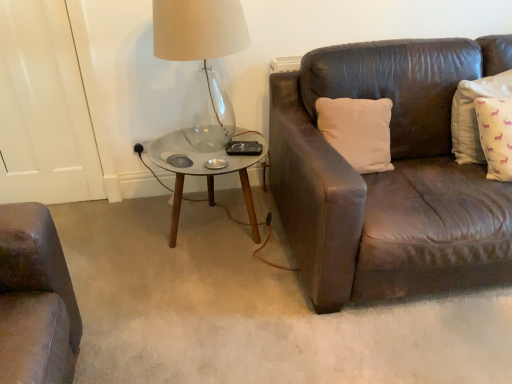
Locate an element on the screen. The height and width of the screenshot is (384, 512). vacant space in front of metallic glass coffee table at center is located at coordinates tap(212, 303).